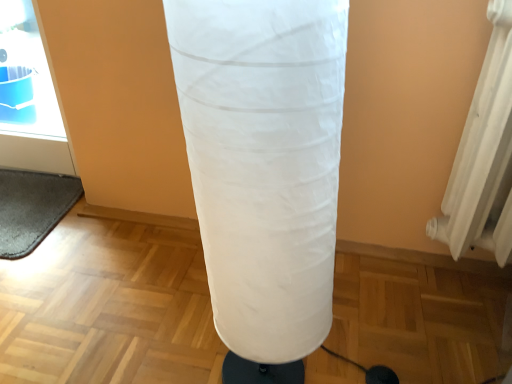
Question: Considering the relative sizes of gray fuzzy yoga mat at lower left and white fabric punching bag at center in the image provided, is gray fuzzy yoga mat at lower left wider than white fabric punching bag at center?

Choices:
 (A) yes
 (B) no

Answer: (A)

Question: Is gray fuzzy yoga mat at lower left further to camera compared to white fabric punching bag at center?

Choices:
 (A) no
 (B) yes

Answer: (B)

Question: Does gray fuzzy yoga mat at lower left appear on the left side of white fabric punching bag at center?

Choices:
 (A) yes
 (B) no

Answer: (A)

Question: Does gray fuzzy yoga mat at lower left have a lesser width compared to white fabric punching bag at center?

Choices:
 (A) yes
 (B) no

Answer: (B)

Question: Are gray fuzzy yoga mat at lower left and white fabric punching bag at center located far from each other?

Choices:
 (A) no
 (B) yes

Answer: (A)

Question: Is white fabric punching bag at center at the back of gray fuzzy yoga mat at lower left?

Choices:
 (A) no
 (B) yes

Answer: (A)

Question: From the image's perspective, is white fabric punching bag at center on gray fuzzy yoga mat at lower left?

Choices:
 (A) no
 (B) yes

Answer: (A)

Question: Could you tell me if white fabric punching bag at center is facing gray fuzzy yoga mat at lower left?

Choices:
 (A) yes
 (B) no

Answer: (B)

Question: Is white fabric punching bag at center to the right of gray fuzzy yoga mat at lower left from the viewer's perspective?

Choices:
 (A) no
 (B) yes

Answer: (B)

Question: Can you see white fabric punching bag at center touching gray fuzzy yoga mat at lower left?

Choices:
 (A) yes
 (B) no

Answer: (B)

Question: Can you confirm if white fabric punching bag at center is thinner than gray fuzzy yoga mat at lower left?

Choices:
 (A) yes
 (B) no

Answer: (A)

Question: Is white fabric punching bag at center outside of gray fuzzy yoga mat at lower left?

Choices:
 (A) no
 (B) yes

Answer: (B)

Question: In terms of width, does gray fuzzy yoga mat at lower left look wider or thinner when compared to white fabric punching bag at center?

Choices:
 (A) thin
 (B) wide

Answer: (B)